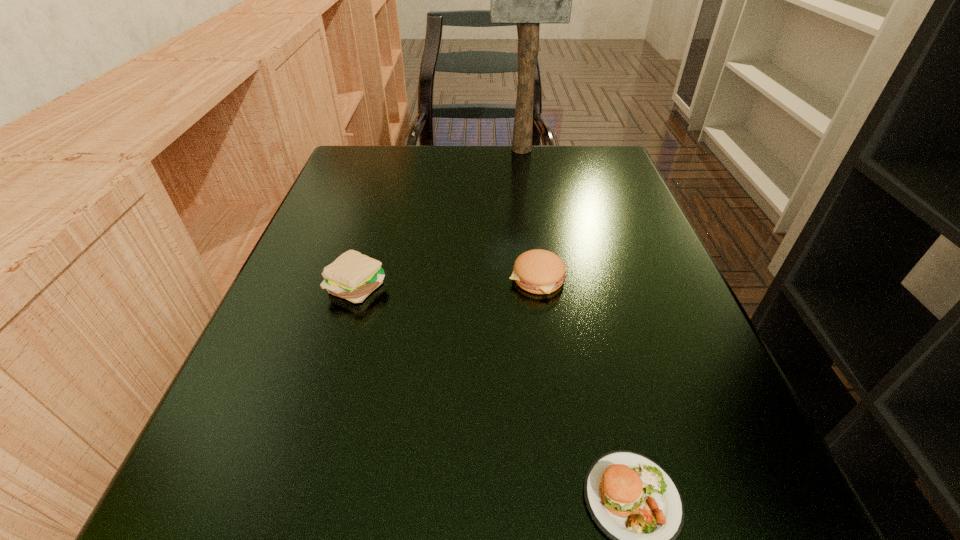
Find the location of a particular element. vacant space at the far edge of the desktop is located at coordinates (436, 154).

Where is `free location at the near edge of the desktop`? free location at the near edge of the desktop is located at coordinates (508, 474).

At what (x,y) coordinates should I click in order to perform the action: click on free region at the left edge of the desktop. Please return your answer as a coordinate pair (x, y). The height and width of the screenshot is (540, 960). Looking at the image, I should click on (373, 204).

Image resolution: width=960 pixels, height=540 pixels. In the image, there is a desktop. What are the coordinates of `vacant space at the right edge` in the screenshot? It's located at (628, 304).

This screenshot has height=540, width=960. Find the location of `vacant area at the far left corner`. vacant area at the far left corner is located at coordinates (361, 156).

Image resolution: width=960 pixels, height=540 pixels. Identify the location of free space at the near left corner of the desktop. (182, 484).

Find the location of `free space at the far right corner of the desktop`. free space at the far right corner of the desktop is located at coordinates (605, 163).

This screenshot has width=960, height=540. In the image, there is a desktop. Identify the location of vacant space at the near right corner. (778, 502).

This screenshot has height=540, width=960. I want to click on free area in between the leftmost patty and the farthest object, so click(x=440, y=218).

Identify which object is the second nearest to the farthest object. Please provide its 2D coordinates. Your answer should be formatted as a tuple, i.e. [(x, y)], where the tuple contains the x and y coordinates of a point satisfying the conditions above.

[(353, 276)]